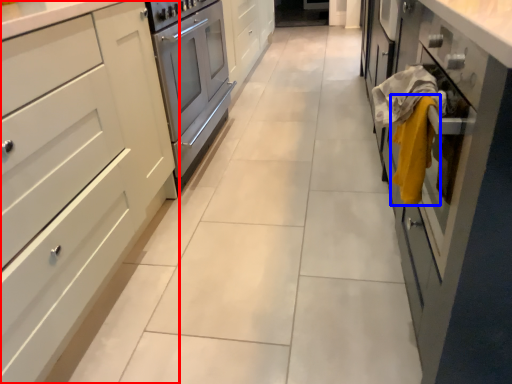
Question: Which object appears farthest to the camera in this image, cabinetry (highlighted by a red box) or blanket (highlighted by a blue box)?

Choices:
 (A) cabinetry
 (B) blanket

Answer: (B)